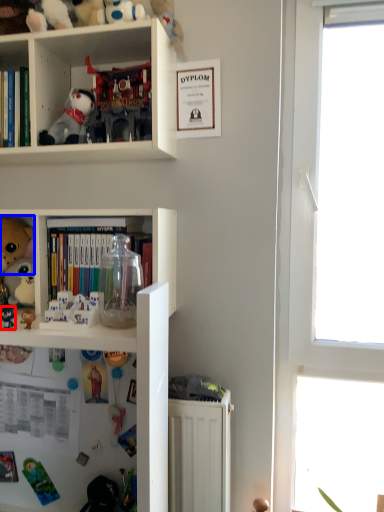
Question: Which object appears farthest to the camera in this image, toy (highlighted by a red box) or toy (highlighted by a blue box)?

Choices:
 (A) toy
 (B) toy

Answer: (B)